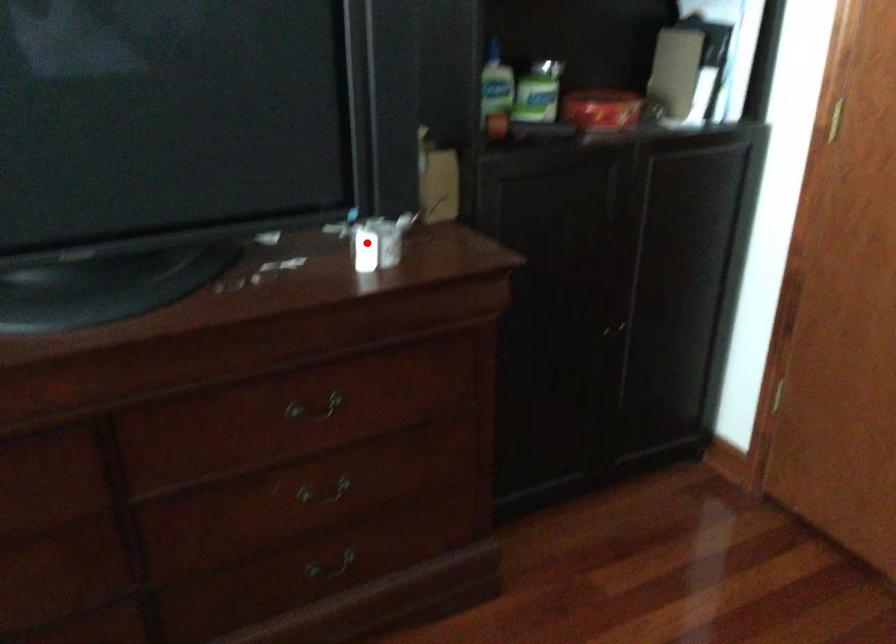
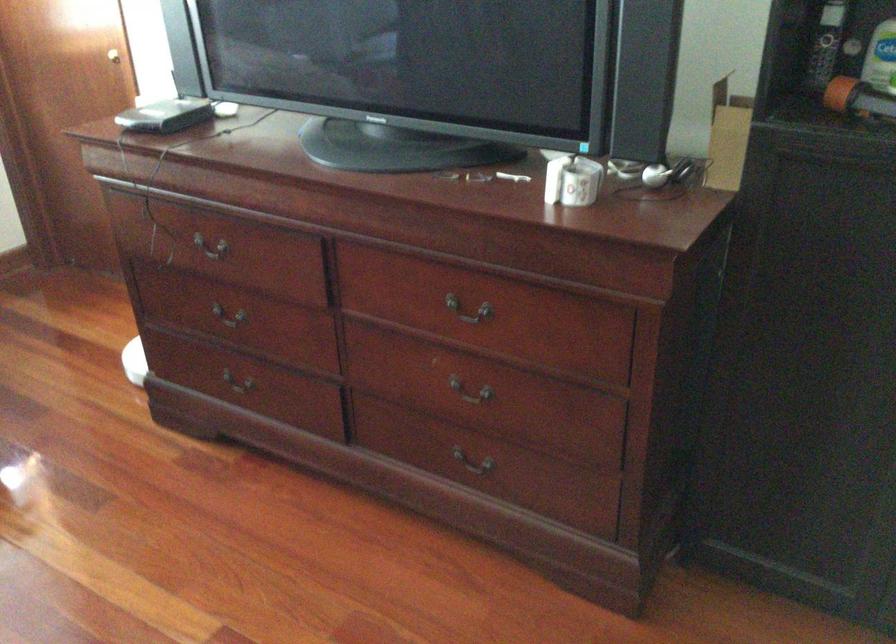
Where in the second image is the point corresponding to the highlighted location from the first image?

(572, 180)